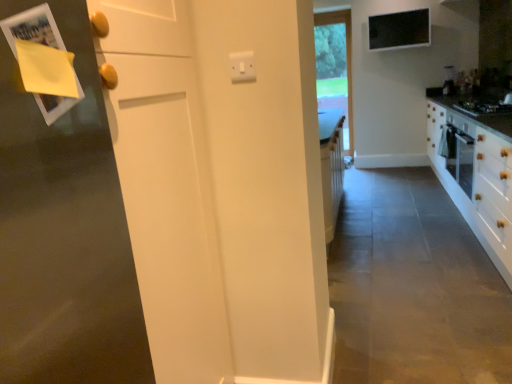
Question: Is black glass gas stove at right not within clear glass window at center?

Choices:
 (A) yes
 (B) no

Answer: (A)

Question: Is black glass gas stove at right bigger than clear glass window at center?

Choices:
 (A) yes
 (B) no

Answer: (B)

Question: From the image's perspective, does black glass gas stove at right appear lower than clear glass window at center?

Choices:
 (A) yes
 (B) no

Answer: (A)

Question: From a real-world perspective, is black glass gas stove at right physically above clear glass window at center?

Choices:
 (A) no
 (B) yes

Answer: (A)

Question: Does black glass gas stove at right have a lesser height compared to clear glass window at center?

Choices:
 (A) no
 (B) yes

Answer: (B)

Question: Considering the relative sizes of black glass gas stove at right and clear glass window at center in the image provided, is black glass gas stove at right taller than clear glass window at center?

Choices:
 (A) no
 (B) yes

Answer: (A)

Question: Is clear glass window at center oriented towards black glass gas stove at right?

Choices:
 (A) yes
 (B) no

Answer: (B)

Question: Are clear glass window at center and black glass gas stove at right making contact?

Choices:
 (A) no
 (B) yes

Answer: (A)

Question: Does clear glass window at center have a lesser height compared to black glass gas stove at right?

Choices:
 (A) yes
 (B) no

Answer: (B)

Question: Can you confirm if clear glass window at center is smaller than black glass gas stove at right?

Choices:
 (A) yes
 (B) no

Answer: (B)

Question: Is clear glass window at center far away from black glass gas stove at right?

Choices:
 (A) yes
 (B) no

Answer: (A)

Question: Is clear glass window at center looking in the opposite direction of black glass gas stove at right?

Choices:
 (A) yes
 (B) no

Answer: (B)

Question: From a real-world perspective, is black glass gas stove at right above or below clear glass window at center?

Choices:
 (A) below
 (B) above

Answer: (A)